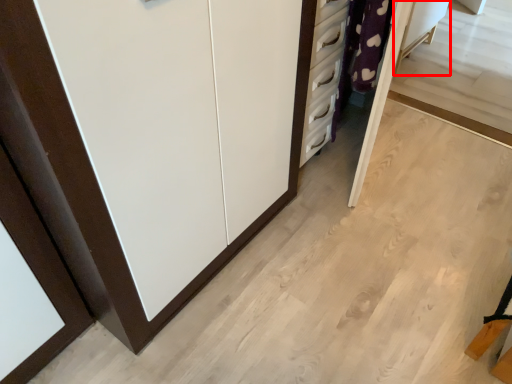
Question: Considering the relative positions of vanity (annotated by the red box) and cupboard in the image provided, where is vanity (annotated by the red box) located with respect to the staircase?

Choices:
 (A) left
 (B) right

Answer: (B)